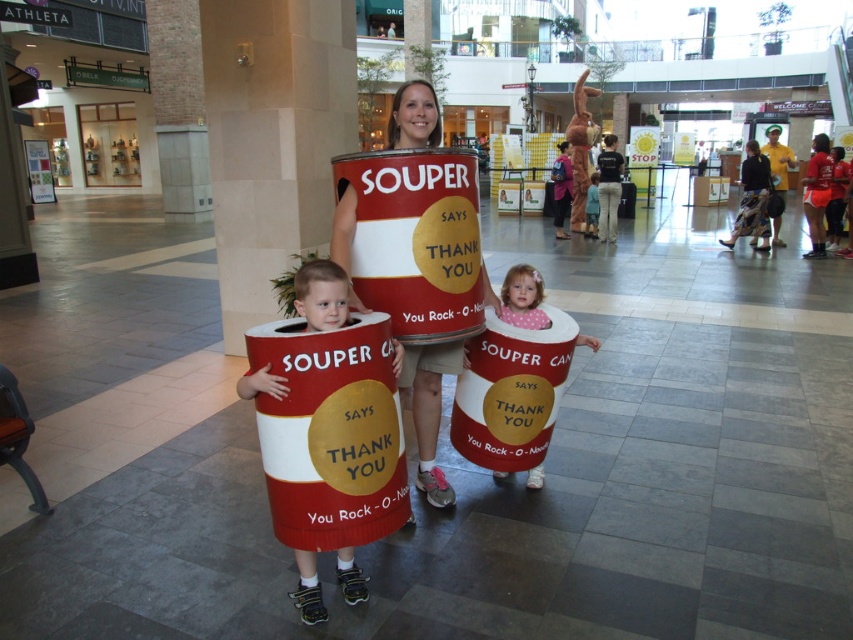
Question: Which point appears farthest from the camera in this image?

Choices:
 (A) (397, 141)
 (B) (595, 180)

Answer: (B)

Question: Does matte cardboard can at lower right appear on the right side of light blue fabric dress at center?

Choices:
 (A) yes
 (B) no

Answer: (B)

Question: Can you confirm if matte cardboard can at center is positioned to the right of matte cardboard can at lower right?

Choices:
 (A) no
 (B) yes

Answer: (A)

Question: Which of the following is the closest to the observer?

Choices:
 (A) matte cardboard can at lower right
 (B) matte cardboard can at center

Answer: (B)

Question: Does matte cardboard can at lower right come behind light blue fabric dress at center?

Choices:
 (A) yes
 (B) no

Answer: (B)

Question: Which point is closer to the camera?

Choices:
 (A) 532,486
 (B) 315,611
 (C) 399,90

Answer: (B)